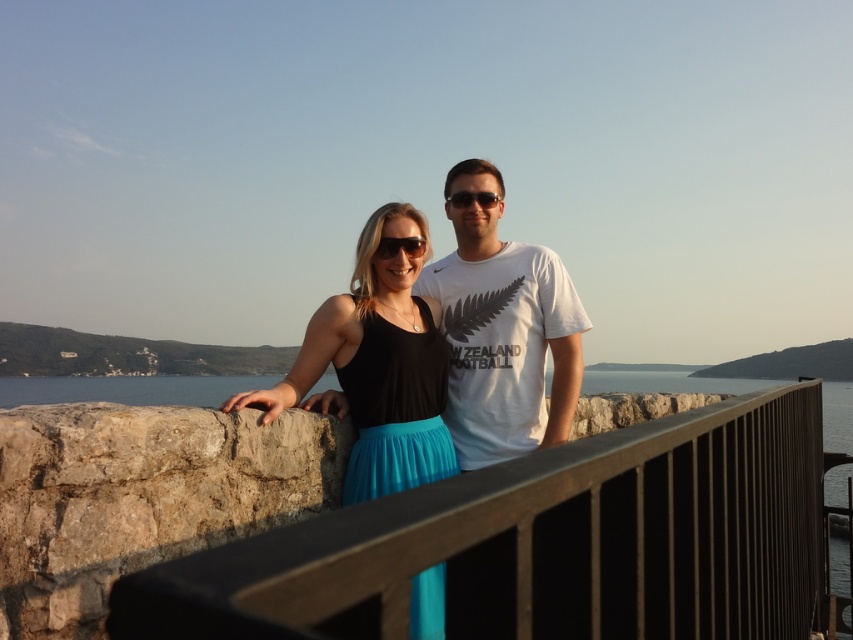
Does brown wooden rail at center lie in front of black plastic sunglasses at center?

Yes, brown wooden rail at center is closer to the viewer.

Between point (512, 609) and point (469, 196), which one is positioned in front?

Point (512, 609) is more forward.

Measure the distance between point (329, 540) and camera.

A distance of 24.98 inches exists between point (329, 540) and camera.

The width and height of the screenshot is (853, 640). I want to click on brown wooden rail at center, so point(543,545).

Does matte black sunglasses at center have a smaller size compared to black plastic sunglasses at center?

Indeed, matte black sunglasses at center has a smaller size compared to black plastic sunglasses at center.

Is point (409, 237) positioned after point (474, 195)?

No, it is in front of (474, 195).

Does point (376, 256) come behind point (467, 205)?

No, it is in front of (467, 205).

Locate an element on the screen. This screenshot has height=640, width=853. matte black sunglasses at center is located at coordinates (399, 246).

Is white cotton t-shirt at center above black plastic sunglasses at center?

Actually, white cotton t-shirt at center is below black plastic sunglasses at center.

Who is more distant from viewer, (485, 230) or (495, 195)?

Point (485, 230)

Measure the distance between white cotton t-shirt at center and camera.

The distance of white cotton t-shirt at center from camera is 15.94 feet.

At what (x,y) coordinates should I click in order to perform the action: click on white cotton t-shirt at center. Please return your answer as a coordinate pair (x, y). This screenshot has height=640, width=853. Looking at the image, I should click on (502, 330).